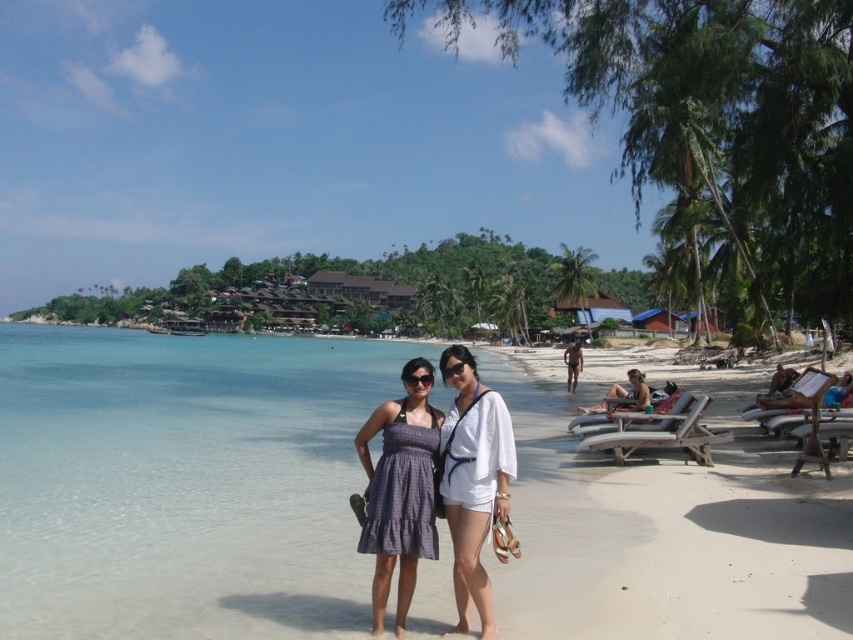
Can you confirm if tan skin man at lower right is thinner than tan skin man at center?

Indeed, tan skin man at lower right has a lesser width compared to tan skin man at center.

Based on the photo, how distant is tan skin man at lower right from tan skin man at center?

The distance of tan skin man at lower right from tan skin man at center is 13.10 meters.

Is point (637, 380) farther from viewer compared to point (572, 388)?

No.

Identify the location of tan skin man at lower right. Image resolution: width=853 pixels, height=640 pixels. (637, 388).

Can you confirm if matte purple dress at center is shorter than white cotton shorts at center?

Correct, matte purple dress at center is not as tall as white cotton shorts at center.

Which is behind, point (474, 493) or point (451, 486)?

The point (451, 486) is more distant.

Image resolution: width=853 pixels, height=640 pixels. What do you see at coordinates (439, 484) in the screenshot? I see `matte purple dress at center` at bounding box center [439, 484].

Image resolution: width=853 pixels, height=640 pixels. What are the coordinates of `matte purple dress at center` in the screenshot? It's located at (439, 484).

Measure the distance between white sand beach at center and matte purple dress at center.

white sand beach at center and matte purple dress at center are 24.38 meters apart from each other.

Which is in front, point (550, 518) or point (459, 611)?

Point (459, 611) is in front.

This screenshot has width=853, height=640. I want to click on white sand beach at center, so (183, 483).